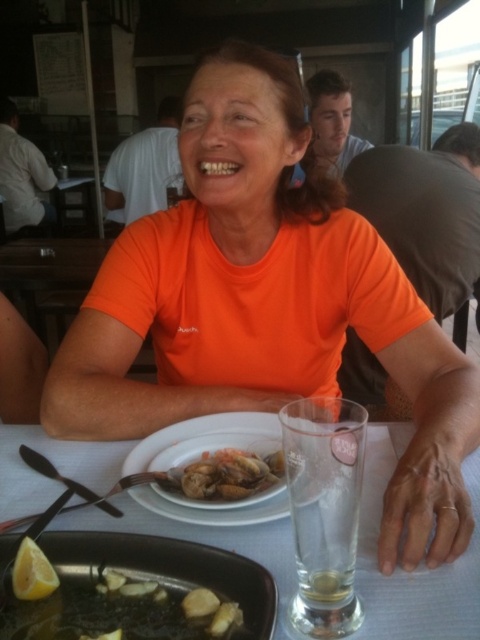
You are a waiter at an outdoor restaurant and need to clear the table. You see the shiny silver pan at lower left and the white matte plate at center. Which item should you pick up first to ensure you can fit both into the trash bin without overfilling it?

The shiny silver pan at lower left should be picked up first because it occupies less space than the white matte plate at center, allowing you to fit both items into the trash bin more easily.

You are a waiter at an outdoor restaurant. You need to clear the dishes from the table. The customer has finished eating. Which object should you pick up first, the white glossy plate at center or the shiny brown clams at center, considering their sizes?

The white glossy plate at center has a larger size compared to shiny brown clams at center, so you should pick up the white glossy plate at center first as it takes up more space on the table.

You are a waiter at an outdoor restaurant and need to place a drink order for the customer. The customer has a white glossy plate at center on the table. Where should you place the drink to avoid it being too close to the plate?

The drink should be placed more than 15.54 inches away from the white glossy plate at center to avoid being too close.